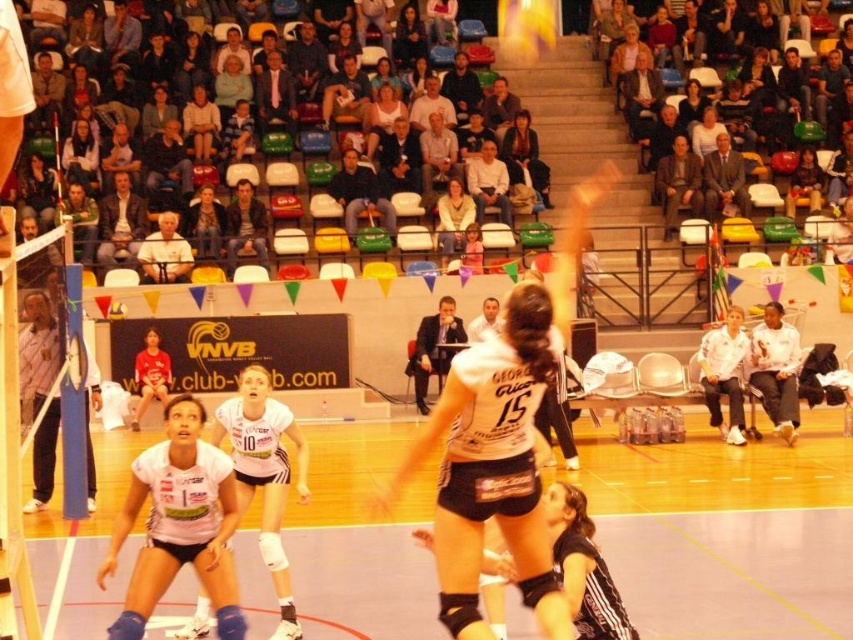
Question: Can you confirm if white matte jersey at center is thinner than white matte volleyball player at center?

Choices:
 (A) no
 (B) yes

Answer: (A)

Question: Which of these objects is positioned closest to the dark brown hair at upper center?

Choices:
 (A) smooth white blouse at upper center
 (B) white matte volleyball player at lower left
 (C) matte white shirt at upper left

Answer: (A)

Question: Can you confirm if white matte jersey at center is positioned above white matte volleyball player at center?

Choices:
 (A) yes
 (B) no

Answer: (A)

Question: Can you confirm if white matte volleyball player at center is thinner than smooth white blouse at upper center?

Choices:
 (A) no
 (B) yes

Answer: (A)

Question: Which point is farther to the camera?

Choices:
 (A) (409, 12)
 (B) (264, 456)
 (C) (403, 81)

Answer: (A)

Question: Among these points, which one is nearest to the camera?

Choices:
 (A) (426, 54)
 (B) (82, 172)
 (C) (698, 116)
 (D) (514, 397)

Answer: (D)